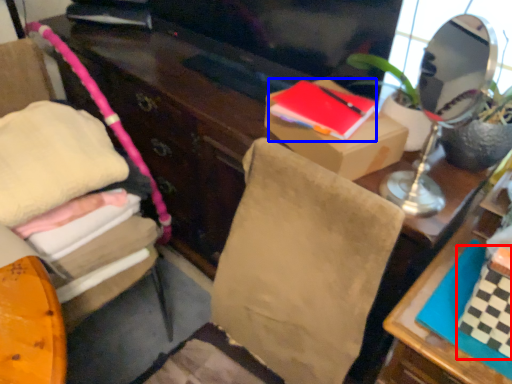
Question: Which point is further to the camera, book (highlighted by a red box) or book (highlighted by a blue box)?

Choices:
 (A) book
 (B) book

Answer: (B)